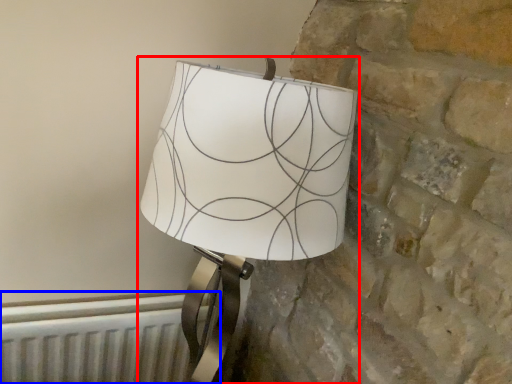
Question: Which object is closer to the camera taking this photo, lamp (highlighted by a red box) or radiator (highlighted by a blue box)?

Choices:
 (A) lamp
 (B) radiator

Answer: (A)